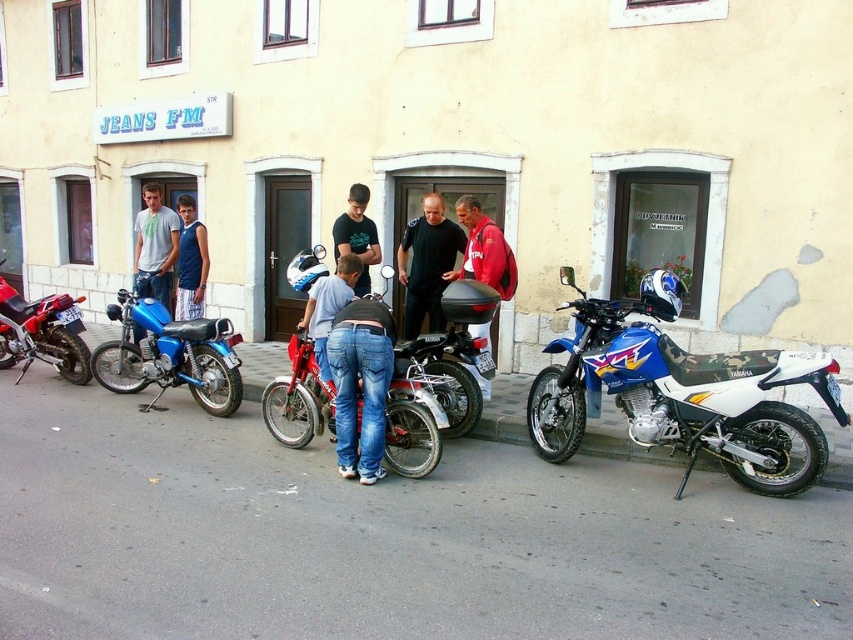
Is point (276, 397) closer to camera compared to point (364, 225)?

Yes, point (276, 397) is in front of point (364, 225).

The width and height of the screenshot is (853, 640). Describe the element at coordinates (412, 420) in the screenshot. I see `metallic red motorcycle at center` at that location.

Describe the element at coordinates (412, 420) in the screenshot. I see `metallic red motorcycle at center` at that location.

Where is `metallic red motorcycle at center`? metallic red motorcycle at center is located at coordinates (412, 420).

Who is more distant from viewer, (576, 356) or (364, 273)?

Positioned behind is point (364, 273).

Identify the location of camo-textured motorcycle at right. (679, 392).

This screenshot has width=853, height=640. Find the location of `camo-textured motorcycle at right`. camo-textured motorcycle at right is located at coordinates (679, 392).

Does black leather jacket at center have a lesser height compared to blue fabric shirt at center?

Correct, black leather jacket at center is not as tall as blue fabric shirt at center.

Can you confirm if black leather jacket at center is taller than blue fabric shirt at center?

No, black leather jacket at center is not taller than blue fabric shirt at center.

Measure the distance between black leather jacket at center and camera.

black leather jacket at center and camera are 7.68 meters apart.

Image resolution: width=853 pixels, height=640 pixels. I want to click on black leather jacket at center, so click(x=427, y=264).